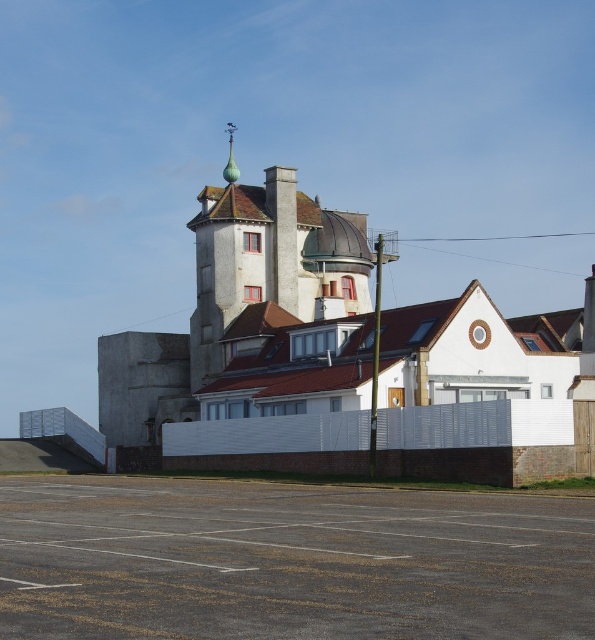
Question: Which point is closer to the camera taking this photo?

Choices:
 (A) [234, 164]
 (B) [220, 500]
 (C) [203, 337]

Answer: (B)

Question: Which of the following is the closest to the observer?

Choices:
 (A) gray asphalt parking lot at lower center
 (B) green glazed tile spire at upper center
 (C) smooth gray tower at center

Answer: (A)

Question: Can you confirm if gray asphalt parking lot at lower center is positioned above green glazed tile spire at upper center?

Choices:
 (A) no
 (B) yes

Answer: (A)

Question: Observing the image, what is the correct spatial positioning of smooth gray tower at center in reference to green glazed tile spire at upper center?

Choices:
 (A) below
 (B) above

Answer: (A)

Question: Which of the following is the closest to the observer?

Choices:
 (A) (227, 161)
 (B) (236, 294)
 (C) (89, 486)

Answer: (C)

Question: Does gray asphalt parking lot at lower center appear on the left side of smooth gray tower at center?

Choices:
 (A) no
 (B) yes

Answer: (A)